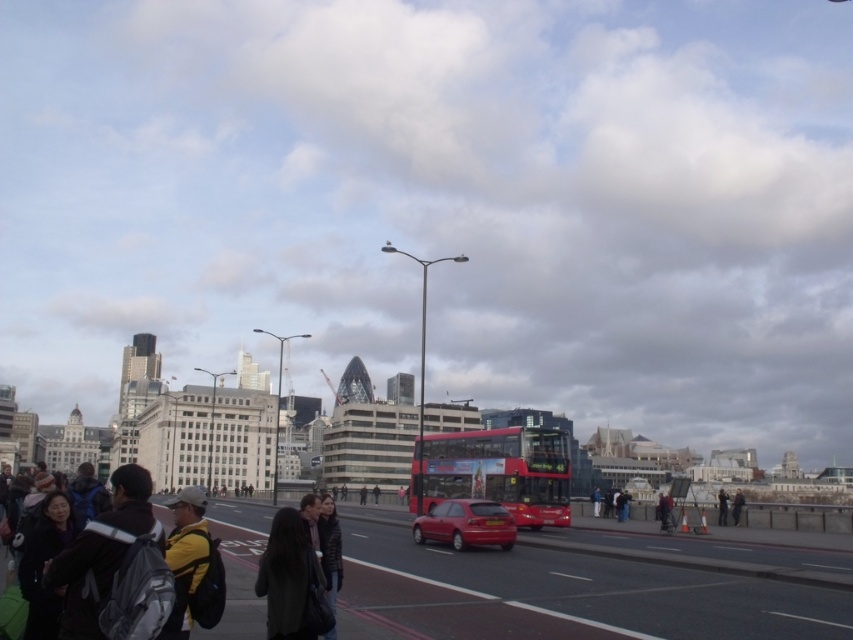
You are a delivery drone that needs to fly from the dark gray coat at center to the dark gray jacket at center. Given that your drone has a maximum range of 60 meters, will you be able to make the trip without recharging?

The distance between the dark gray coat at center and the dark gray jacket at center is 61.49 meters, which exceeds the drone maximum range of 60 meters. Therefore, the drone cannot make the trip without recharging.

You are a photographer standing on the bridge and want to capture both the dark gray coat at center and the dark gray jacket at center in the same frame. Which clothing item will appear taller in the photo?

The dark gray jacket at center will appear taller in the photo because it is taller than the dark gray coat at center.

Based on the photo, what are the coordinates of the yellow fabric jacket at lower left in the image?

The yellow fabric jacket at lower left is located at coordinates (192, 566).